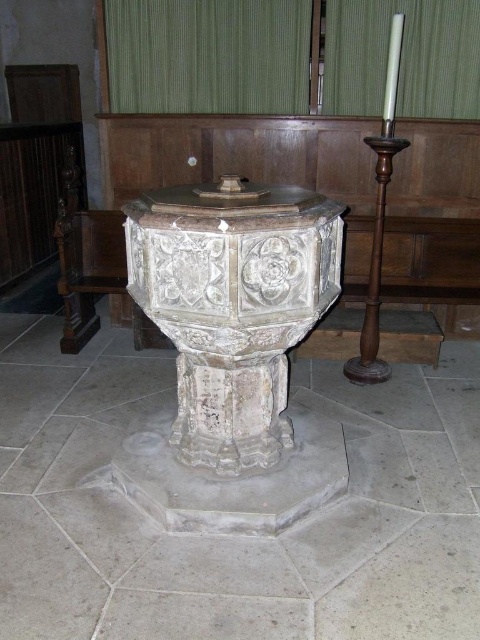
Does white stone baptismal font at center appear on the left side of carved stone baptismal font at center?

Incorrect, white stone baptismal font at center is not on the left side of carved stone baptismal font at center.

Which of these two, white stone baptismal font at center or carved stone baptismal font at center, stands shorter?

white stone baptismal font at center

Is point (111, 401) more distant than point (245, 209)?

Yes.

Where is `white stone baptismal font at center`? white stone baptismal font at center is located at coordinates (231, 536).

Is white stone baptismal font at center bigger than green fabric curtain at upper center?

Indeed, white stone baptismal font at center has a larger size compared to green fabric curtain at upper center.

Who is lower down, white stone baptismal font at center or green fabric curtain at upper center?

Result: white stone baptismal font at center is below.

Where is `white stone baptismal font at center`? This screenshot has height=640, width=480. white stone baptismal font at center is located at coordinates (231, 536).

The image size is (480, 640). What are the coordinates of `white stone baptismal font at center` in the screenshot? It's located at (231, 536).

Is point (223, 348) closer to viewer compared to point (344, 84)?

Yes.

Is point (244, 244) more distant than point (226, 45)?

No, (244, 244) is in front of (226, 45).

The height and width of the screenshot is (640, 480). What are the coordinates of `carved stone baptismal font at center` in the screenshot? It's located at (232, 305).